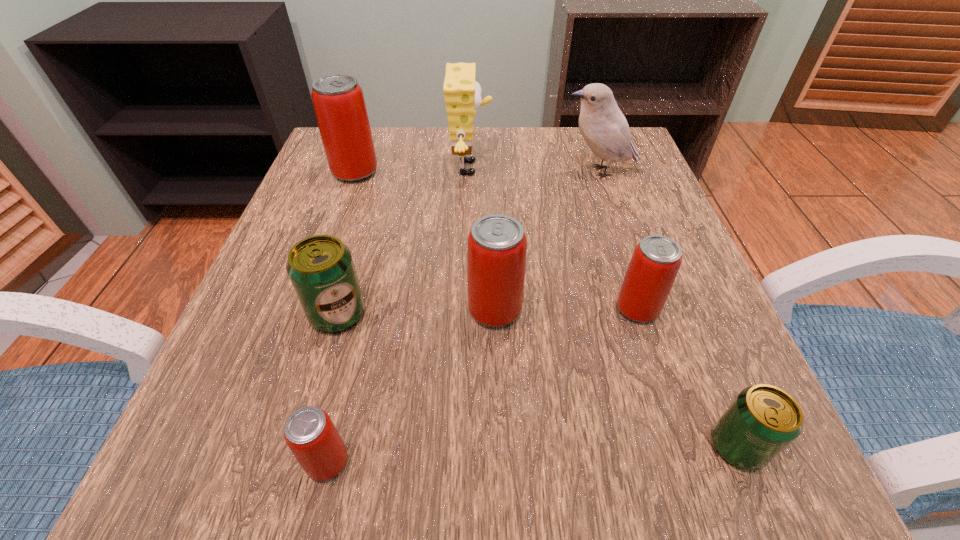
Identify the location of object that is at the far right corner. (603, 126).

This screenshot has height=540, width=960. What are the coordinates of `object that is at the near right corner` in the screenshot? It's located at (763, 420).

This screenshot has width=960, height=540. In the image, there is a desktop. In order to click on vacant space at the far edge in this screenshot , I will do `click(473, 134)`.

I want to click on vacant space at the near edge, so click(x=502, y=456).

In the image, there is a desktop. Where is `vacant region at the left edge`? vacant region at the left edge is located at coordinates (333, 228).

At what (x,y) coordinates should I click in order to perform the action: click on vacant space at the far left corner of the desktop. Please return your answer as a coordinate pair (x, y). This screenshot has height=540, width=960. Looking at the image, I should click on (384, 174).

The image size is (960, 540). In order to click on vacant area at the near left corner of the desktop in this screenshot , I will do `click(190, 486)`.

Image resolution: width=960 pixels, height=540 pixels. I want to click on free space at the far right corner of the desktop, so click(641, 152).

Find the location of a particular element. This screenshot has height=540, width=960. vacant region between the left green beer can and the third beer can from right to left is located at coordinates point(417,312).

Image resolution: width=960 pixels, height=540 pixels. What are the coordinates of `free space between the bird and the rightmost pink beer can` in the screenshot? It's located at (618, 240).